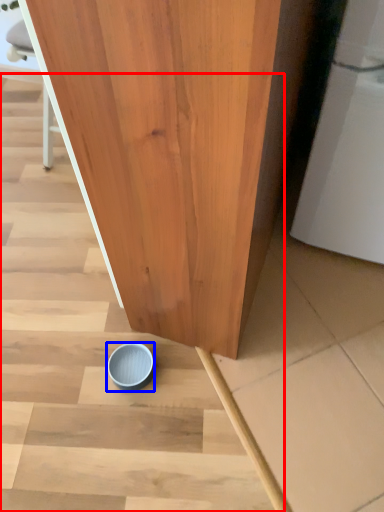
Question: Which object is further to the camera taking this photo, stairwell (highlighted by a red box) or tableware (highlighted by a blue box)?

Choices:
 (A) stairwell
 (B) tableware

Answer: (B)